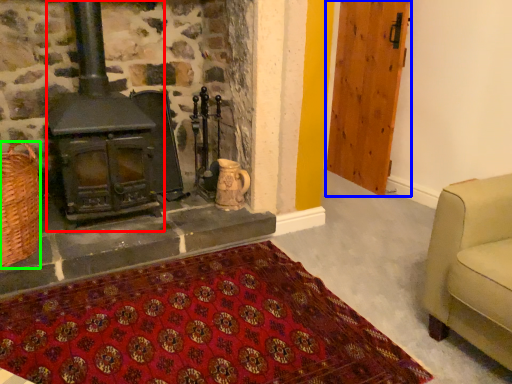
Question: Which object is the closest to the wood burning stove (highlighted by a red box)? Choose among these: door (highlighted by a blue box) or basket (highlighted by a green box).

Choices:
 (A) door
 (B) basket

Answer: (B)